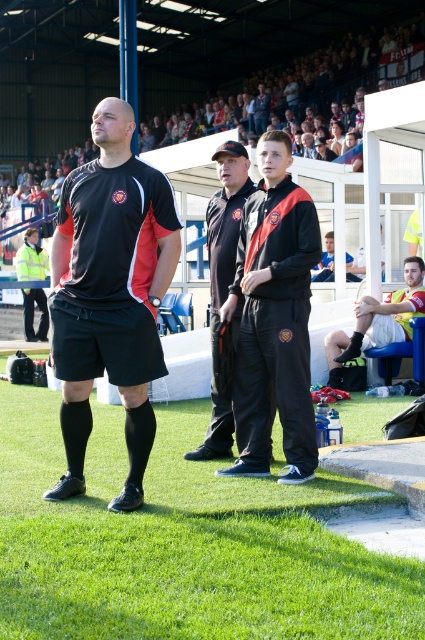
Which is in front, point (274, 538) or point (331, 243)?

Point (274, 538) is more forward.

Does green grass at lower left lie behind blue fabric shirt at center?

No, green grass at lower left is closer to the viewer.

Is point (180, 449) closer to camera compared to point (320, 268)?

Yes, it is in front of point (320, 268).

The height and width of the screenshot is (640, 425). I want to click on green grass at lower left, so click(x=181, y=544).

Does point (147, 435) come behind point (380, 301)?

No, it is not.

Who is shorter, black matte shorts at center or yellow/textured fabric shirt at lower right?

Standing shorter between the two is yellow/textured fabric shirt at lower right.

Where is `black matte shorts at center`? The height and width of the screenshot is (640, 425). black matte shorts at center is located at coordinates pyautogui.click(x=110, y=292).

Can you confirm if black matte shorts at center is thinner than black matte tracksuit at center?

No.

Is point (87, 164) positioned in front of point (283, 324)?

Yes, point (87, 164) is closer to viewer.

Between point (62, 353) and point (289, 394), which one is positioned behind?

The point (289, 394) is behind.

Find the location of a particular element. This screenshot has height=640, width=425. black matte shorts at center is located at coordinates (110, 292).